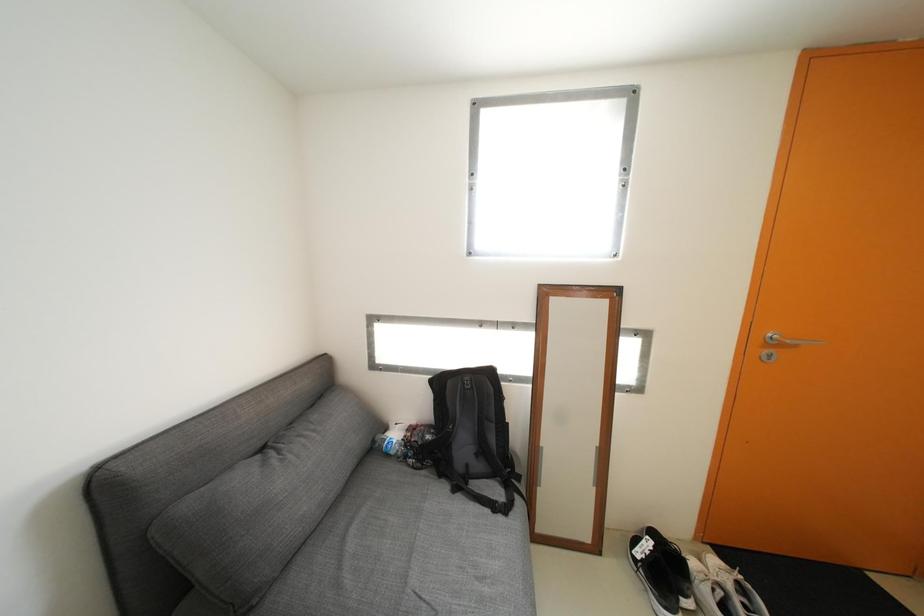
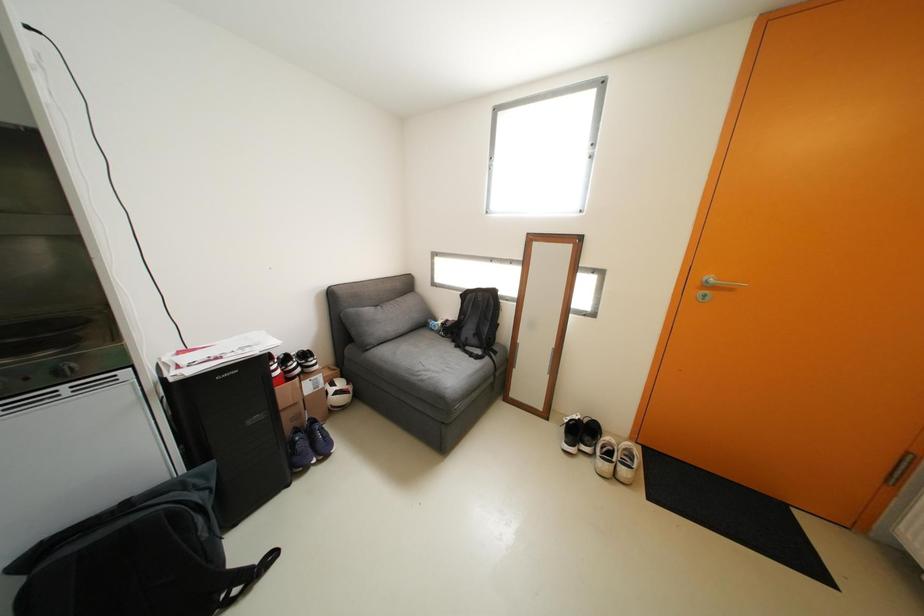
The images are taken continuously from a first-person perspective. In which direction are you moving?

The cameraman moved toward right, backward.